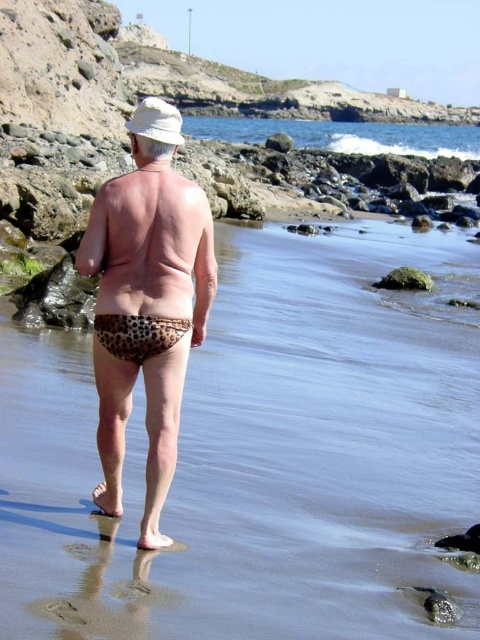
You are a photographer trying to capture the silhouette of the leopard print swimwear at center in the shallow water. Based on the scene description, where should you position your camera to ensure the swimwear is centered in your shot?

Position the camera at point [146,304] to center the leopard print swimwear at center in the shot.

You are a photographer positioned at the camera location. You want to capture a closeup shot of the person on the beach. Which of the two points, point (145, 333) or point (387, 150), should you focus on to ensure the person is in focus?

You should focus on point (145, 333) because it is closer to the viewer than point (387, 150), ensuring the person is in focus.

You are a photographer positioned at the camera location. You want to capture a closeup shot of the leopard print swimwear at center. Considering your current distance, is it feasible to take the photo without moving closer?

The leopard print swimwear at center and camera are 14.93 meters apart from each other. To capture a closeup shot from this distance, you would need a telephoto lens capable of zooming sufficiently. Without moving closer, it is possible but depends on the lens quality.